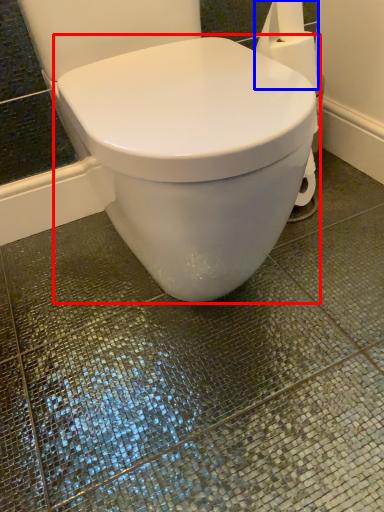
Question: Which of the following is the farthest to the observer, toilet (highlighted by a red box) or toilet paper (highlighted by a blue box)?

Choices:
 (A) toilet
 (B) toilet paper

Answer: (B)